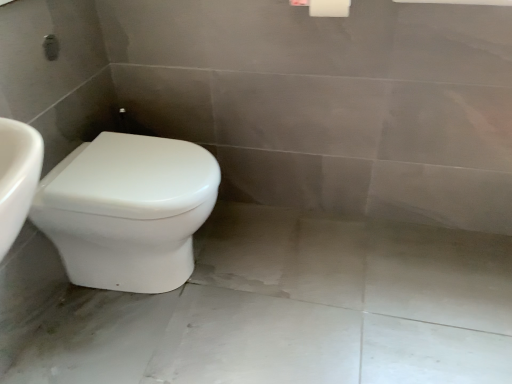
Question: From the image's perspective, is white glossy toilet at lower left above or below white glossy concrete at lower left?

Choices:
 (A) below
 (B) above

Answer: (B)

Question: Would you say white glossy toilet at lower left is inside or outside white glossy concrete at lower left?

Choices:
 (A) inside
 (B) outside

Answer: (B)

Question: From their relative heights in the image, would you say white glossy toilet at lower left is taller or shorter than white glossy concrete at lower left?

Choices:
 (A) short
 (B) tall

Answer: (B)

Question: Looking at the image, does white glossy concrete at lower left seem bigger or smaller compared to white glossy toilet at lower left?

Choices:
 (A) small
 (B) big

Answer: (A)

Question: Is point (76, 355) closer or farther from the camera than point (117, 226)?

Choices:
 (A) farther
 (B) closer

Answer: (A)

Question: In terms of height, does white glossy concrete at lower left look taller or shorter compared to white glossy toilet at lower left?

Choices:
 (A) short
 (B) tall

Answer: (A)

Question: Is white glossy concrete at lower left inside the boundaries of white glossy toilet at lower left, or outside?

Choices:
 (A) inside
 (B) outside

Answer: (B)